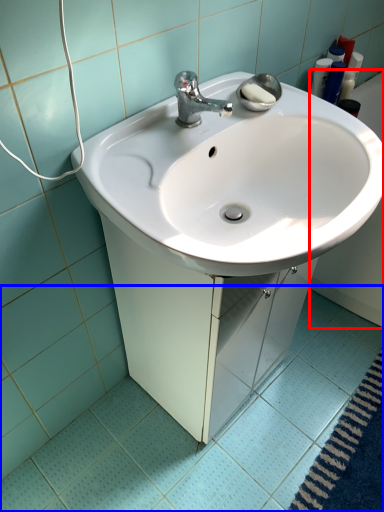
Question: Among these objects, which one is farthest to the camera, bath (highlighted by a red box) or ceramic tile (highlighted by a blue box)?

Choices:
 (A) bath
 (B) ceramic tile

Answer: (A)